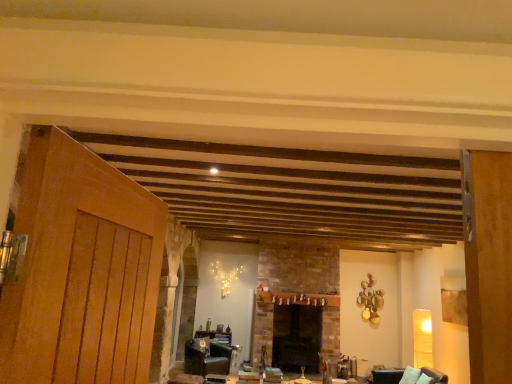
Question: Can you confirm if matte black armchair at lower left is taller than dark brown leather armchair at lower right?

Choices:
 (A) yes
 (B) no

Answer: (A)

Question: Considering the relative sizes of matte black armchair at lower left and dark brown leather armchair at lower right in the image provided, is matte black armchair at lower left bigger than dark brown leather armchair at lower right?

Choices:
 (A) yes
 (B) no

Answer: (A)

Question: Is matte black armchair at lower left aimed at dark brown leather armchair at lower right?

Choices:
 (A) no
 (B) yes

Answer: (B)

Question: Is matte black armchair at lower left facing away from dark brown leather armchair at lower right?

Choices:
 (A) no
 (B) yes

Answer: (A)

Question: From a real-world perspective, is matte black armchair at lower left under dark brown leather armchair at lower right?

Choices:
 (A) no
 (B) yes

Answer: (B)

Question: Considering the relative positions of matte black armchair at lower left and dark brown leather armchair at lower right in the image provided, is matte black armchair at lower left to the right of dark brown leather armchair at lower right from the viewer's perspective?

Choices:
 (A) no
 (B) yes

Answer: (A)

Question: Does wooden table at center have a smaller size compared to matte black armchair at lower left?

Choices:
 (A) no
 (B) yes

Answer: (B)

Question: Is wooden table at center shorter than matte black armchair at lower left?

Choices:
 (A) no
 (B) yes

Answer: (B)

Question: Considering the relative positions of wooden table at center and matte black armchair at lower left in the image provided, is wooden table at center behind matte black armchair at lower left?

Choices:
 (A) yes
 (B) no

Answer: (A)

Question: From a real-world perspective, is wooden table at center located beneath matte black armchair at lower left?

Choices:
 (A) no
 (B) yes

Answer: (A)

Question: From the image's perspective, is wooden table at center beneath matte black armchair at lower left?

Choices:
 (A) yes
 (B) no

Answer: (B)

Question: Does wooden table at center have a larger size compared to matte black armchair at lower left?

Choices:
 (A) yes
 (B) no

Answer: (B)

Question: Does dark brick fireplace at center lie behind dark brown leather armchair at lower right?

Choices:
 (A) no
 (B) yes

Answer: (B)